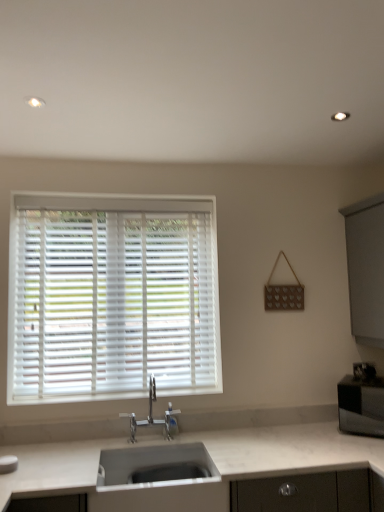
This screenshot has height=512, width=384. I want to click on free space underneath white plastic blinds at upper left (from a real-world perspective), so click(x=122, y=393).